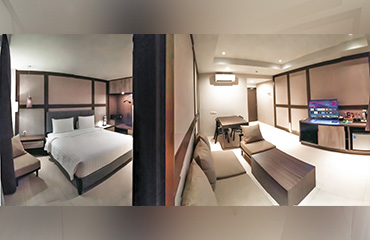
This screenshot has width=370, height=240. What are the coordinates of `pillows` in the screenshot? It's located at (60, 123), (88, 121), (17, 148), (204, 158), (200, 138), (199, 192), (247, 133).